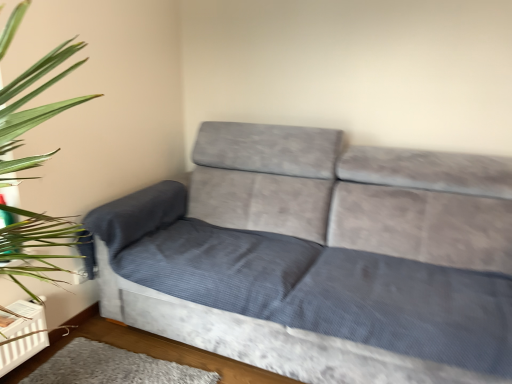
Where is `gray soft rug at lower center`? gray soft rug at lower center is located at coordinates (112, 367).

The width and height of the screenshot is (512, 384). Describe the element at coordinates (112, 367) in the screenshot. I see `gray soft rug at lower center` at that location.

What do you see at coordinates (321, 258) in the screenshot?
I see `velvet gray couch at center` at bounding box center [321, 258].

In order to click on velvet gray couch at center in this screenshot , I will do `click(321, 258)`.

Find the location of a particular element. This screenshot has width=512, height=384. gray soft rug at lower center is located at coordinates (112, 367).

Which object is positioned more to the left, velvet gray couch at center or gray soft rug at lower center?

From the viewer's perspective, gray soft rug at lower center appears more on the left side.

Is velvet gray couch at center further to the viewer compared to gray soft rug at lower center?

No, velvet gray couch at center is closer to the viewer.

Considering the points (511, 323) and (136, 368), which point is behind, point (511, 323) or point (136, 368)?

Point (136, 368)

From the image's perspective, is velvet gray couch at center positioned above or below gray soft rug at lower center?

A: velvet gray couch at center is above gray soft rug at lower center.

From a real-world perspective, which is physically below, velvet gray couch at center or gray soft rug at lower center?

In real-world perspective, gray soft rug at lower center is lower.

Can you confirm if velvet gray couch at center is wider than gray soft rug at lower center?

Yes, velvet gray couch at center is wider than gray soft rug at lower center.

Considering the sizes of objects velvet gray couch at center and gray soft rug at lower center in the image provided, who is taller, velvet gray couch at center or gray soft rug at lower center?

Standing taller between the two is velvet gray couch at center.

Considering the sizes of objects velvet gray couch at center and gray soft rug at lower center in the image provided, who is smaller, velvet gray couch at center or gray soft rug at lower center?

With smaller size is gray soft rug at lower center.

Is velvet gray couch at center surrounding gray soft rug at lower center?

No, gray soft rug at lower center is not a part of velvet gray couch at center.

Is velvet gray couch at center far from gray soft rug at lower center?

No, velvet gray couch at center is in close proximity to gray soft rug at lower center.

Looking at this image, is velvet gray couch at center looking in the opposite direction of gray soft rug at lower center?

No.

How many degrees apart are the facing directions of velvet gray couch at center and gray soft rug at lower center?

There is a 3.99-degree angle between the facing directions of velvet gray couch at center and gray soft rug at lower center.

Find the location of a particular element. studio couch above the gray soft rug at lower center (from the image's perspective) is located at coordinates (321, 258).

Which object is positioned more to the left, gray soft rug at lower center or velvet gray couch at center?

From the viewer's perspective, gray soft rug at lower center appears more on the left side.

Considering their positions, is gray soft rug at lower center located in front of or behind velvet gray couch at center?

Clearly, gray soft rug at lower center is behind velvet gray couch at center.

Does point (112, 354) come behind point (148, 225)?

No, it is not.

From the image's perspective, would you say gray soft rug at lower center is positioned over velvet gray couch at center?

No, from the image's perspective, gray soft rug at lower center is not above velvet gray couch at center.

From a real-world perspective, is gray soft rug at lower center located higher than velvet gray couch at center?

No, from a real-world perspective, gray soft rug at lower center is not on top of velvet gray couch at center.

Which of these two, gray soft rug at lower center or velvet gray couch at center, is wider?

Wider between the two is velvet gray couch at center.

Between gray soft rug at lower center and velvet gray couch at center, which one has more height?

Standing taller between the two is velvet gray couch at center.

Considering the relative sizes of gray soft rug at lower center and velvet gray couch at center in the image provided, is gray soft rug at lower center bigger than velvet gray couch at center?

No.

Would you say gray soft rug at lower center is inside or outside velvet gray couch at center?

The correct answer is: outside.

Is gray soft rug at lower center positioned far away from velvet gray couch at center?

gray soft rug at lower center is near velvet gray couch at center, not far away.

Is gray soft rug at lower center oriented away from velvet gray couch at center?

Yes, gray soft rug at lower center is positioned with its back facing velvet gray couch at center.

Where is `mat below the velvet gray couch at center (from the image's perspective)`? This screenshot has height=384, width=512. mat below the velvet gray couch at center (from the image's perspective) is located at coordinates tap(112, 367).

In order to click on mat that is under the velvet gray couch at center (from a real-world perspective) in this screenshot , I will do `click(112, 367)`.

Find the location of a particular element. studio couch that is above the gray soft rug at lower center (from a real-world perspective) is located at coordinates (321, 258).